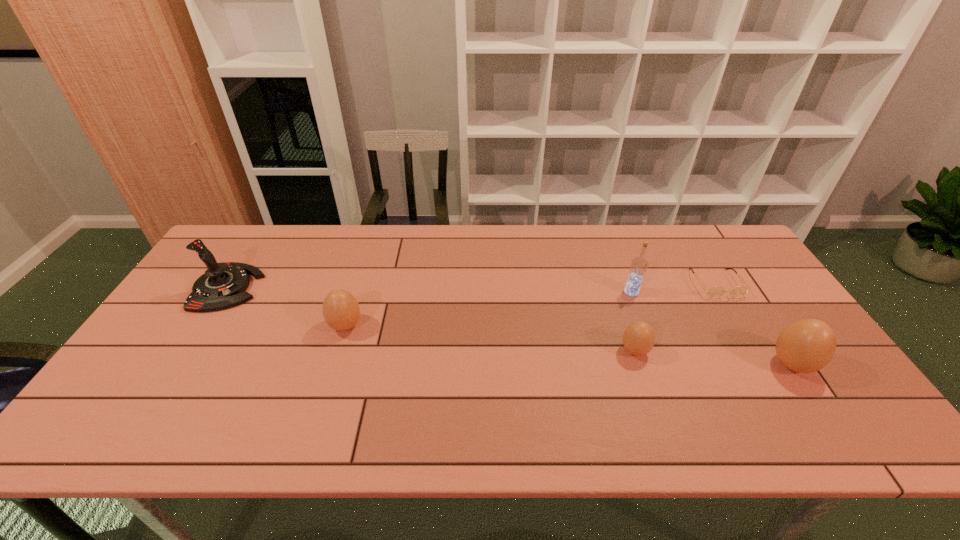
Locate an element on the screen. The width and height of the screenshot is (960, 540). the leftmost boiled egg is located at coordinates (341, 311).

Where is `the fourth farthest object`? the fourth farthest object is located at coordinates (341, 311).

Find the location of a particular element. the shortest boiled egg is located at coordinates (638, 339).

At what (x,y) coordinates should I click in order to perform the action: click on the second shortest object. Please return your answer as a coordinate pair (x, y). The image size is (960, 540). Looking at the image, I should click on (638, 339).

Where is `the tallest boiled egg`? The width and height of the screenshot is (960, 540). the tallest boiled egg is located at coordinates (808, 345).

The height and width of the screenshot is (540, 960). I want to click on the rightmost boiled egg, so click(x=808, y=345).

I want to click on joystick, so click(223, 285).

I want to click on spectacles, so click(x=714, y=292).

At what (x,y) coordinates should I click in order to perform the action: click on vodka. Please return your answer as a coordinate pair (x, y). This screenshot has width=960, height=540. Looking at the image, I should click on (639, 265).

The image size is (960, 540). In order to click on free region located on the front of the third nearest object in this screenshot , I will do `click(324, 396)`.